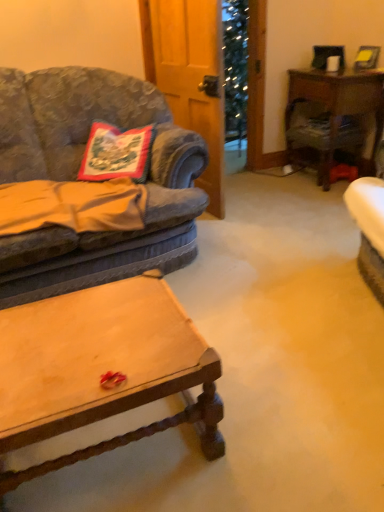
This screenshot has height=512, width=384. I want to click on wooden desk at right, so click(x=333, y=116).

This screenshot has height=512, width=384. What do you see at coordinates (116, 153) in the screenshot?
I see `embroidered fabric pillow at left` at bounding box center [116, 153].

Describe the element at coordinates (101, 369) in the screenshot. I see `wooden coffee table at center` at that location.

Where is `wooden desk at right`? The width and height of the screenshot is (384, 512). wooden desk at right is located at coordinates (333, 116).

Is wooden coffee table at center next to wooden desk at right?

wooden coffee table at center is not next to wooden desk at right, and they're not touching.

Would you say wooden coffee table at center is outside wooden desk at right?

Indeed, wooden coffee table at center is completely outside wooden desk at right.

Does point (133, 289) appear closer or farther from the camera than point (302, 131)?

Clearly, point (133, 289) is closer to the camera than point (302, 131).

Considering the sizes of objects wooden coffee table at center and wooden desk at right in the image provided, who is taller, wooden coffee table at center or wooden desk at right?

wooden desk at right.

Is the depth of velvet fabric couch at left greater than that of embroidered fabric pillow at left?

No, velvet fabric couch at left is closer to the viewer.

Is velvet fabric couch at left inside the boundaries of embroidered fabric pillow at left, or outside?

velvet fabric couch at left exists outside the volume of embroidered fabric pillow at left.

From a real-world perspective, which is physically above, velvet fabric couch at left or embroidered fabric pillow at left?

embroidered fabric pillow at left.

Does velvet fabric couch at left have a greater width compared to embroidered fabric pillow at left?

Indeed, velvet fabric couch at left has a greater width compared to embroidered fabric pillow at left.

Is wooden coffee table at center with embroidered fabric pillow at left?

wooden coffee table at center is not next to embroidered fabric pillow at left, and they're not touching.

This screenshot has height=512, width=384. I want to click on coffee table in front of the embroidered fabric pillow at left, so click(101, 369).

From a real-world perspective, is wooden coffee table at center physically above embroidered fabric pillow at left?

No, from a real-world perspective, wooden coffee table at center is not on top of embroidered fabric pillow at left.

In the scene shown: Which of these two, wooden coffee table at center or embroidered fabric pillow at left, is smaller?

With smaller size is embroidered fabric pillow at left.

Which of these two, wooden desk at right or wooden coffee table at center, is smaller?

wooden coffee table at center is smaller.

What's the angular difference between wooden desk at right and wooden coffee table at center's facing directions?

92.6 degrees separate the facing orientations of wooden desk at right and wooden coffee table at center.

Which object is positioned more to the left, wooden desk at right or wooden coffee table at center?

Positioned to the left is wooden coffee table at center.

From a real-world perspective, which object stands above the other?

embroidered fabric pillow at left, from a real-world perspective.

What's the angular difference between embroidered fabric pillow at left and wooden coffee table at center's facing directions?

31.9 degrees separate the facing orientations of embroidered fabric pillow at left and wooden coffee table at center.

Is embroidered fabric pillow at left beside wooden coffee table at center?

No.

Does embroidered fabric pillow at left have a smaller size compared to wooden coffee table at center?

Yes.

Is wooden desk at right positioned far away from velvet fabric couch at left?

Absolutely, wooden desk at right is distant from velvet fabric couch at left.

Does wooden desk at right appear on the left side of velvet fabric couch at left?

In fact, wooden desk at right is to the right of velvet fabric couch at left.

Which is further, (x=304, y=127) or (x=132, y=249)?

The point (x=304, y=127) is behind.

Between wooden desk at right and velvet fabric couch at left, which one has smaller size?

wooden desk at right.

Is wooden desk at right to the left of embroidered fabric pillow at left from the viewer's perspective?

Incorrect, wooden desk at right is not on the left side of embroidered fabric pillow at left.

Is point (310, 137) positioned in front of point (82, 166)?

No, it is not.

Is the surface of wooden desk at right in direct contact with embroidered fabric pillow at left?

No.

The image size is (384, 512). What are the coordinates of `coffee table located underneath the wooden desk at right (from a real-world perspective)` in the screenshot? It's located at (101, 369).

This screenshot has height=512, width=384. Find the location of `pillow that appears above the velvet fabric couch at left (from the image's perspective)`. pillow that appears above the velvet fabric couch at left (from the image's perspective) is located at coordinates [x=116, y=153].

Estimate the real-world distances between objects in this image. Which object is closer to velvet fabric couch at left, wooden desk at right or wooden coffee table at center?

Based on the image, wooden coffee table at center appears to be nearer to velvet fabric couch at left.

Which object lies further to the anchor point wooden desk at right, embroidered fabric pillow at left or velvet fabric couch at left?

Based on the image, embroidered fabric pillow at left appears to be further to wooden desk at right.

Which object lies nearer to the anchor point velvet fabric couch at left, embroidered fabric pillow at left or wooden desk at right?

The object closer to velvet fabric couch at left is embroidered fabric pillow at left.

Which object lies nearer to the anchor point wooden desk at right, velvet fabric couch at left or embroidered fabric pillow at left?

Based on the image, velvet fabric couch at left appears to be nearer to wooden desk at right.

Which object lies nearer to the anchor point velvet fabric couch at left, wooden desk at right or embroidered fabric pillow at left?

The object closer to velvet fabric couch at left is embroidered fabric pillow at left.

Looking at the image, which one is located further to wooden desk at right, embroidered fabric pillow at left or wooden coffee table at center?

Among the two, wooden coffee table at center is located further to wooden desk at right.

Considering their positions, is wooden coffee table at center positioned further to velvet fabric couch at left than wooden desk at right?

wooden desk at right is positioned further to the anchor velvet fabric couch at left.

Considering their positions, is wooden coffee table at center positioned closer to embroidered fabric pillow at left than wooden desk at right?

wooden coffee table at center.

The image size is (384, 512). I want to click on pillow positioned between wooden coffee table at center and wooden desk at right from near to far, so coord(116,153).

At what (x,y) coordinates should I click in order to perform the action: click on pillow between velvet fabric couch at left and wooden desk at right in the horizontal direction. Please return your answer as a coordinate pair (x, y). Looking at the image, I should click on point(116,153).

Identify the location of studio couch between wooden coffee table at center and wooden desk at right along the z-axis. (76, 176).

In order to click on studio couch between wooden coffee table at center and embroidered fabric pillow at left in the front-back direction in this screenshot , I will do `click(76, 176)`.